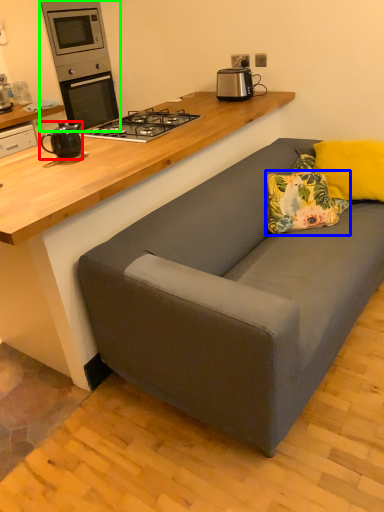
Question: Which object is positioned closest to kitchen appliance (highlighted by a red box)? Select from pillow (highlighted by a blue box) and home appliance (highlighted by a green box).

Choices:
 (A) pillow
 (B) home appliance

Answer: (A)